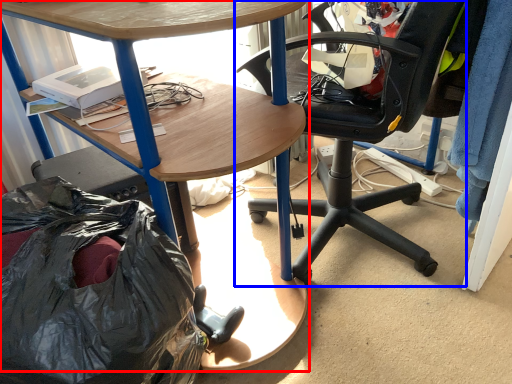
Question: Which object is further to the camera taking this photo, desk (highlighted by a red box) or chair (highlighted by a blue box)?

Choices:
 (A) desk
 (B) chair

Answer: (B)